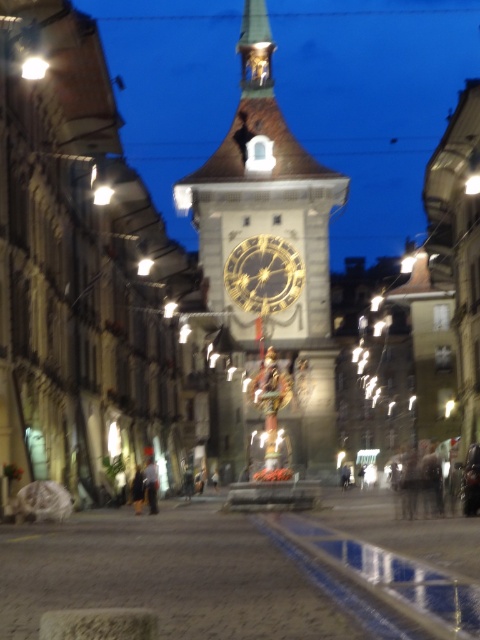
Question: Which object appears farthest from the camera in this image?

Choices:
 (A) gold-plated clock tower at center
 (B) gold metallic clock at center

Answer: (B)

Question: Which of the following is the closest to the observer?

Choices:
 (A) (264, 148)
 (B) (266, 280)

Answer: (B)

Question: Does gold-plated clock tower at center appear over gold metallic clock at center?

Choices:
 (A) yes
 (B) no

Answer: (A)

Question: Which of the following is the farthest from the observer?

Choices:
 (A) gold metallic clock at center
 (B) gold-plated clock tower at center

Answer: (A)

Question: Considering the relative positions of gold-plated clock tower at center and gold metallic clock at center in the image provided, where is gold-plated clock tower at center located with respect to gold metallic clock at center?

Choices:
 (A) left
 (B) right

Answer: (A)

Question: Can you confirm if gold-plated clock tower at center is positioned below gold metallic clock at center?

Choices:
 (A) no
 (B) yes

Answer: (A)